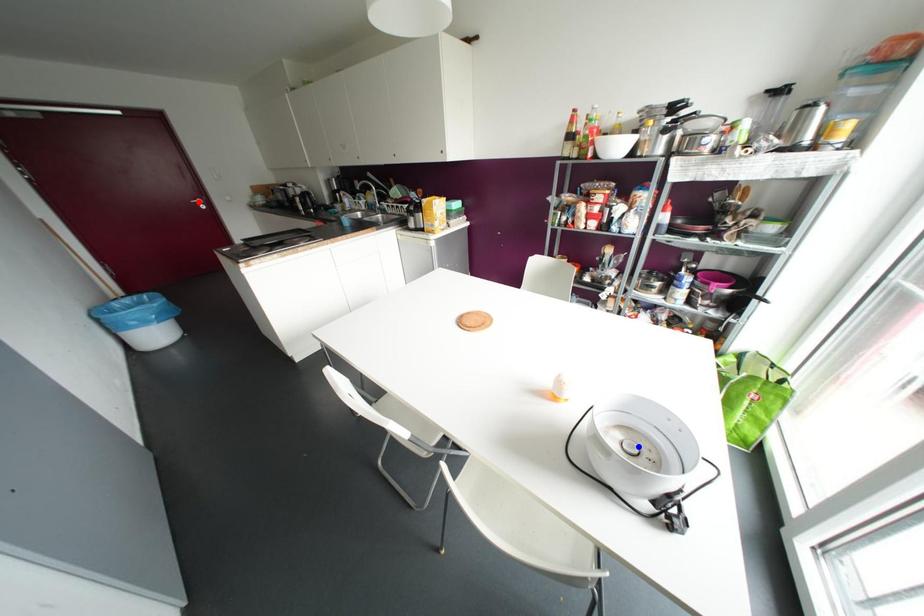
Question: Which of the two points in the image is closer to the camera?

Choices:
 (A) Blue point is closer.
 (B) Red point is closer.

Answer: (A)